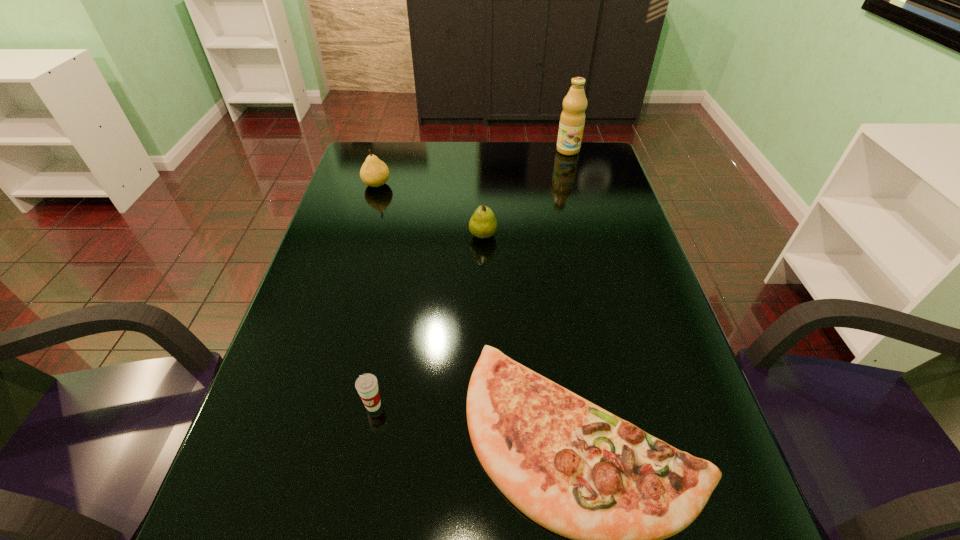
Where is `the tallest object`? The height and width of the screenshot is (540, 960). the tallest object is located at coordinates (572, 119).

This screenshot has width=960, height=540. I want to click on the farthest object, so click(572, 119).

You are a GUI agent. You are given a task and a screenshot of the screen. Output one action in this format:
    pyautogui.click(x=<x>, y=<y>)
    Task: Click on the left pear
    The width and height of the screenshot is (960, 540).
    Given the screenshot: What is the action you would take?
    pyautogui.click(x=374, y=172)

Locate an element on the screen. the leftmost object is located at coordinates (374, 172).

This screenshot has width=960, height=540. In order to click on the right pear in this screenshot , I will do `click(483, 224)`.

What are the coordinates of `the nearer pear` in the screenshot? It's located at (483, 224).

Where is `the second object from left to right`? the second object from left to right is located at coordinates (367, 385).

Identify the location of free space located 0.400m on the label of the farthest object. Image resolution: width=960 pixels, height=540 pixels. (589, 228).

Find the location of a particular element. The width and height of the screenshot is (960, 540). free space located on the front of the fourth nearest object is located at coordinates (362, 235).

The width and height of the screenshot is (960, 540). I want to click on free spot located 0.110m on the front of the right pear, so click(483, 272).